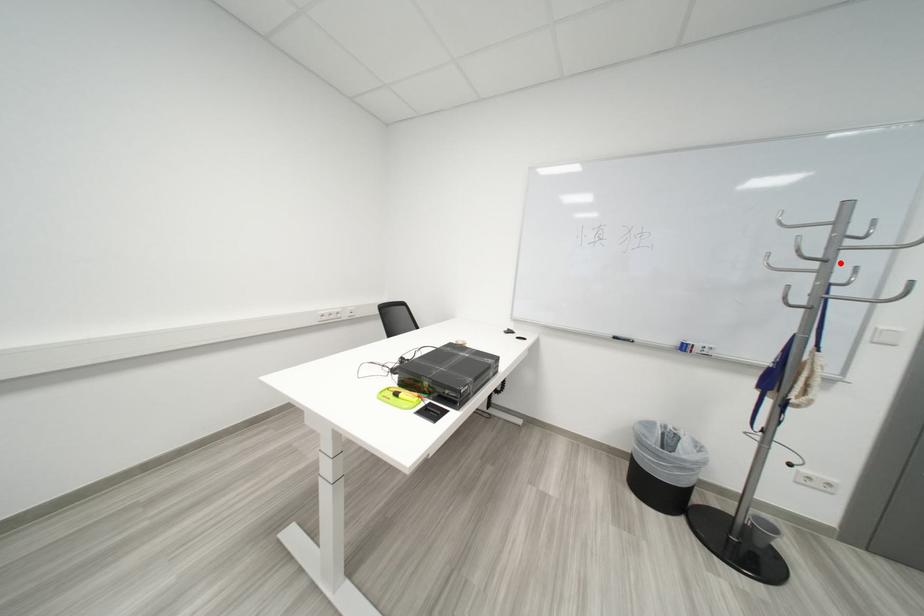
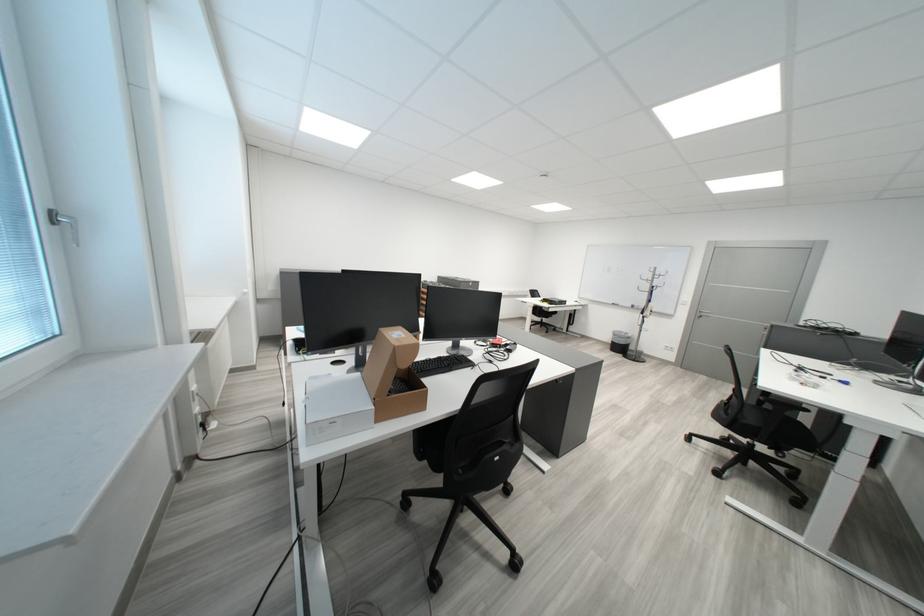
Find the pixel in the second image that matches the highlighted location in the first image.

(665, 283)